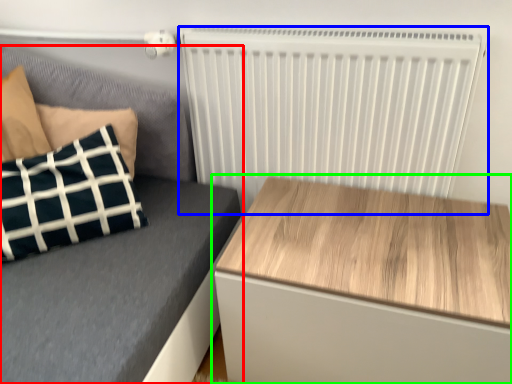
Question: Considering the real-world distances, which object is farthest from furniture (highlighted by a red box)? radiator (highlighted by a blue box) or table (highlighted by a green box)?

Choices:
 (A) radiator
 (B) table

Answer: (B)